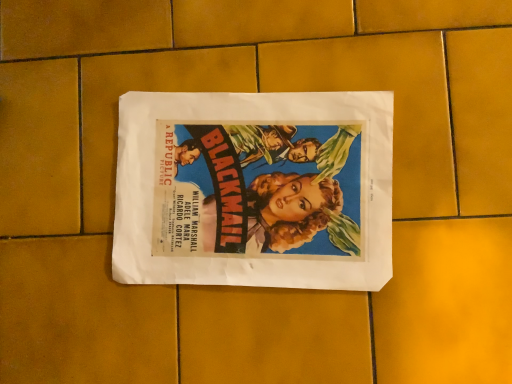
The width and height of the screenshot is (512, 384). Describe the element at coordinates (255, 189) in the screenshot. I see `matte paper poster at center` at that location.

Find the location of a particular element. The image size is (512, 384). matte paper poster at center is located at coordinates (255, 189).

The height and width of the screenshot is (384, 512). In order to click on matte paper poster at center in this screenshot , I will do `click(255, 189)`.